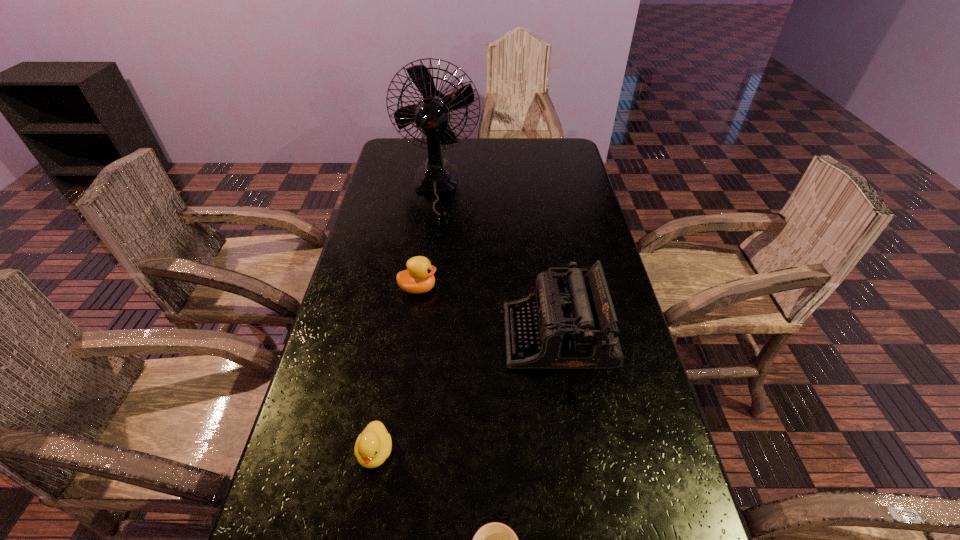
This screenshot has height=540, width=960. In order to click on the tallest object in this screenshot , I will do `click(431, 115)`.

Where is `fan`? This screenshot has width=960, height=540. fan is located at coordinates (431, 115).

The width and height of the screenshot is (960, 540). I want to click on the second tallest object, so click(573, 325).

The image size is (960, 540). I want to click on typewriter, so click(573, 325).

In order to click on the third tallest object in this screenshot , I will do `click(419, 277)`.

Find the location of `the farther duckling`. the farther duckling is located at coordinates (419, 277).

Where is `the fourth farthest object`? Image resolution: width=960 pixels, height=540 pixels. the fourth farthest object is located at coordinates (372, 447).

You are a GUI agent. You are given a task and a screenshot of the screen. Output one action in this format:
    pyautogui.click(x=<x>, y=<y>)
    Task: Click on the nearer duckling
    This screenshot has width=960, height=540.
    Given the screenshot: What is the action you would take?
    pyautogui.click(x=372, y=447)

The height and width of the screenshot is (540, 960). What are the coordinates of `blank space located 0.350m in front of the farthest object, indicating the direction of air flow` in the screenshot? It's located at (420, 303).

At what (x,y) coordinates should I click in order to perform the action: click on vacant space situated 0.340m on the keyboard of the third farthest object. Please return your answer as a coordinate pair (x, y). Looking at the image, I should click on (367, 336).